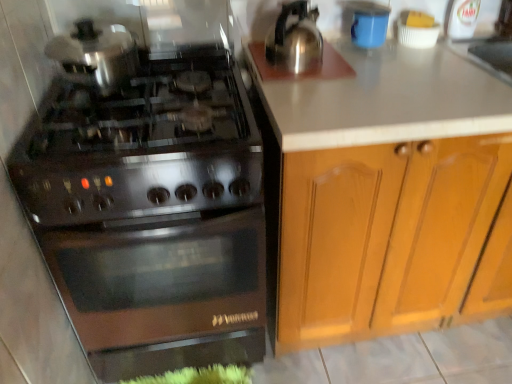
Question: In terms of height, does blue matte cup at upper right look taller or shorter compared to stainless steel gas stove at left?

Choices:
 (A) short
 (B) tall

Answer: (A)

Question: Is point (370, 3) positioned closer to the camera than point (189, 243)?

Choices:
 (A) farther
 (B) closer

Answer: (A)

Question: Which object is positioned farthest from the blue matte cup at upper right?

Choices:
 (A) stainless steel gas stove at left
 (B) wooden cabinet at right

Answer: (A)

Question: Considering the real-world distances, which object is farthest from the stainless steel gas stove at left?

Choices:
 (A) blue matte cup at upper right
 (B) wooden cabinet at right

Answer: (A)